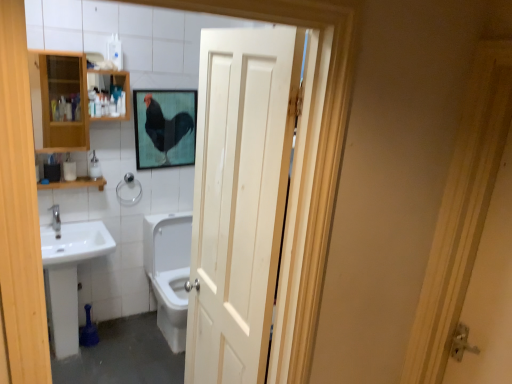
Question: Is point (174, 109) closer or farther from the camera than point (139, 187)?

Choices:
 (A) closer
 (B) farther

Answer: (A)

Question: Is matte black rooster at upper center to the left or to the right of silver metallic towel bar at center left in the image?

Choices:
 (A) right
 (B) left

Answer: (A)

Question: Considering the real-world distances, which object is closest to the white glossy soap dispenser at left?

Choices:
 (A) silver metallic towel bar at center left
 (B) wooden shelf at left
 (C) wooden cabinet at left
 (D) white glossy sink at left
 (E) white matte toilet paper at left

Answer: (B)

Question: Which object is the closest to the matte black rooster at upper center?

Choices:
 (A) white matte toilet paper at left
 (B) wooden shelf at left
 (C) silver metallic towel bar at center left
 (D) white wood door at center
 (E) wooden cabinet at left

Answer: (C)